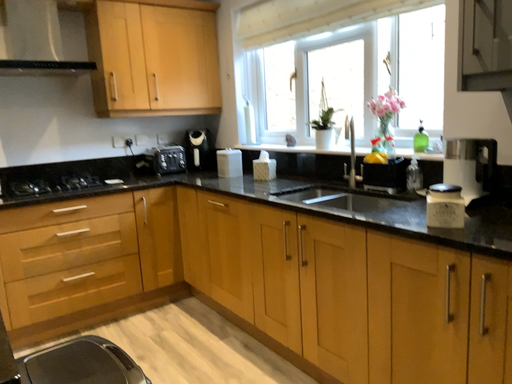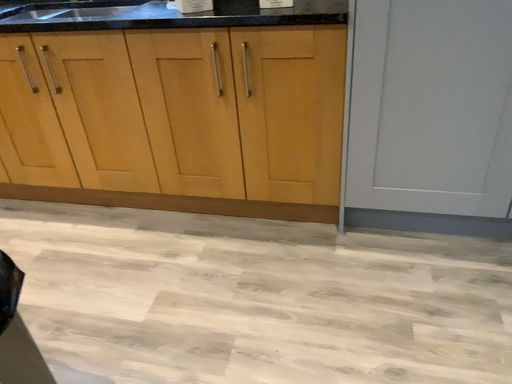
Question: Which way did the camera rotate in the video?

Choices:
 (A) rotated left
 (B) rotated right

Answer: (B)